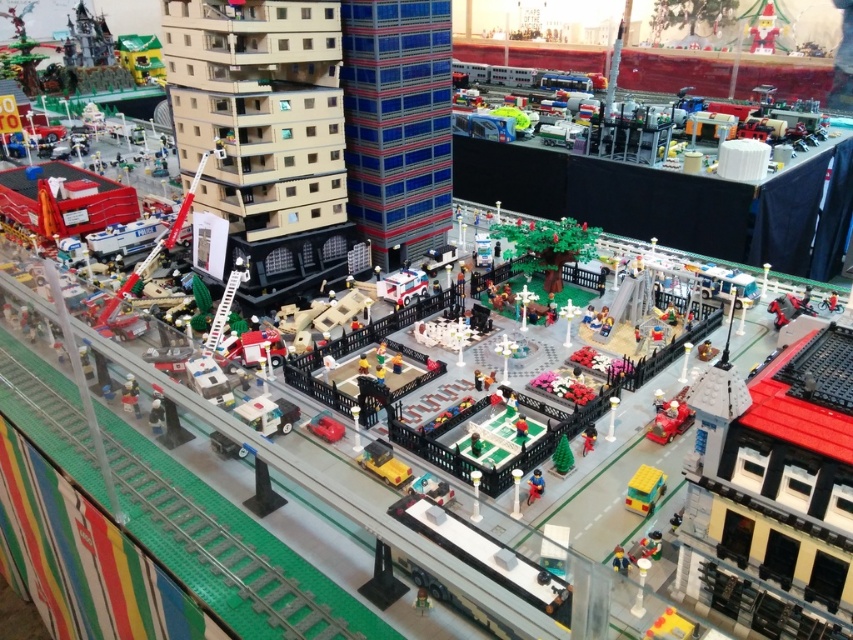
Question: Does yellow matte bus at lower right appear on the right side of smooth plastic bicycle at center?

Choices:
 (A) yes
 (B) no

Answer: (A)

Question: Is metallic red crane at center-left bigger than white plastic ambulance at center?

Choices:
 (A) yes
 (B) no

Answer: (A)

Question: Estimate the real-world distances between objects in this image. Which object is farther from the yellow matte bus at lower right?

Choices:
 (A) shiny red car at center
 (B) smooth plastic bicycle at center

Answer: (A)

Question: Is yellow matte bus at lower right closer to camera compared to white plastic ambulance at center?

Choices:
 (A) yes
 (B) no

Answer: (A)

Question: Among these objects, which one is nearest to the camera?

Choices:
 (A) metallic red crane at center-left
 (B) smooth plastic figure at lower right

Answer: (B)

Question: Which is nearer to the shiny red car at center?

Choices:
 (A) yellow matte bus at lower right
 (B) smooth plastic bicycle at center
 (C) smooth plastic figure at lower right
 (D) metallic red crane at center-left

Answer: (A)